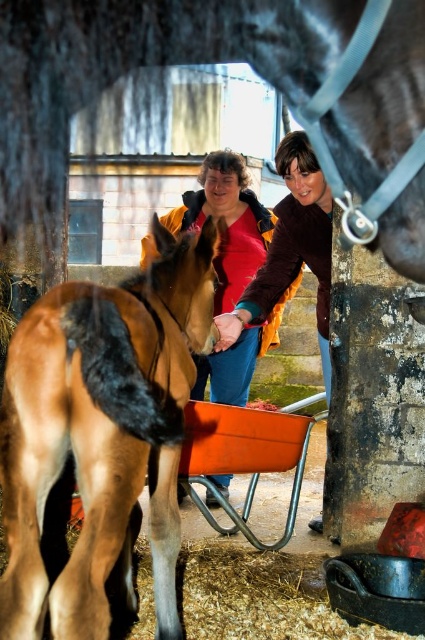
Who is positioned more to the left, matte red vest at center or matte brown jacket at center?

From the viewer's perspective, matte red vest at center appears more on the left side.

Does matte red vest at center have a larger size compared to matte brown jacket at center?

Indeed, matte red vest at center has a larger size compared to matte brown jacket at center.

Is point (226, 372) farther from camera compared to point (306, 148)?

Yes.

Image resolution: width=425 pixels, height=640 pixels. In order to click on matte red vest at center in this screenshot , I will do `click(226, 221)`.

Is brown glossy horse at center wider than matte brown jacket at center?

No.

In the scene shown: Can you confirm if brown glossy horse at center is positioned to the right of matte brown jacket at center?

Incorrect, brown glossy horse at center is not on the right side of matte brown jacket at center.

Between point (149, 273) and point (326, 272), which one is positioned in front?

Point (149, 273) is more forward.

You are a GUI agent. You are given a task and a screenshot of the screen. Output one action in this format:
    pyautogui.click(x=<x>, y=<y>)
    Task: Click on the brown glossy horse at center
    Image resolution: width=425 pixels, height=640 pixels.
    Given the screenshot: What is the action you would take?
    pyautogui.click(x=101, y=432)

Who is more distant from viewer, (144, 381) or (207, 492)?

The point (207, 492) is more distant.

In the scene shown: Is brown glossy horse at center to the left of matte red vest at center from the viewer's perspective?

Yes, brown glossy horse at center is to the left of matte red vest at center.

Who is more forward, (62, 449) or (243, 208)?

Point (62, 449)

Identify the location of brown glossy horse at center. (101, 432).